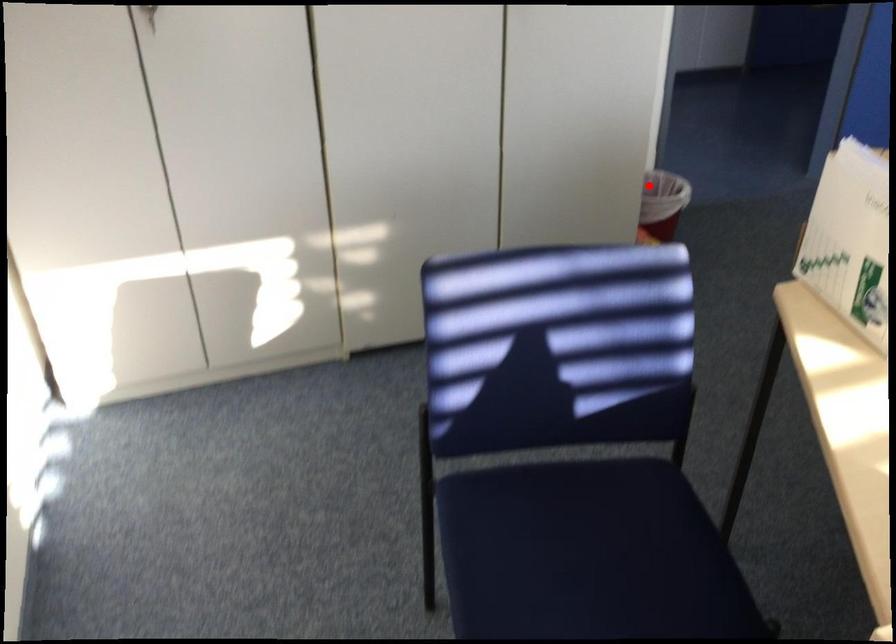
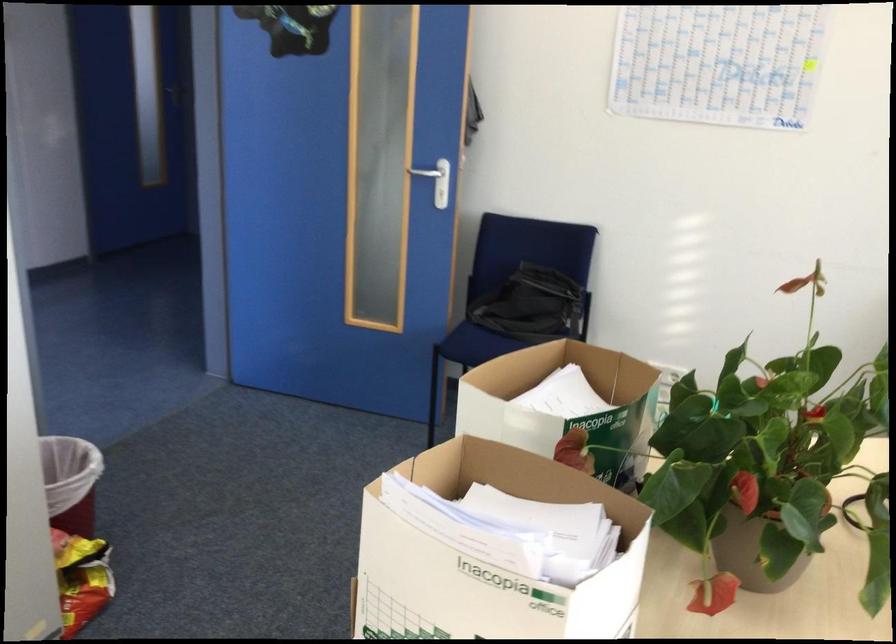
Question: I am providing you with two images of the same scene from different viewpoints. Image1 has a red point marked. In image2, the corresponding 3D location appears at what relative position? Reply with the corresponding letter.

Choices:
 (A) Closer
 (B) Farther

Answer: (A)